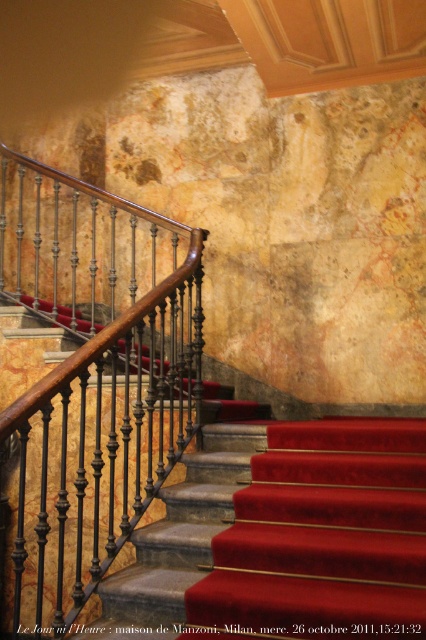
You are an interior designer planning to install a new light fixture. You see the wooden polished handrail at center and the velvet red carpet at center. Which object is closer to the front of the staircase?

The wooden polished handrail at center is closer to the front of the staircase because the velvet red carpet at center is behind it.

You are an interior designer assessing the staircase. You need to determine which object, the wooden polished handrail at center or the velvet red carpet at center, is higher in elevation. Which one is taller?

The wooden polished handrail at center is taller than the velvet red carpet at center according to the description.